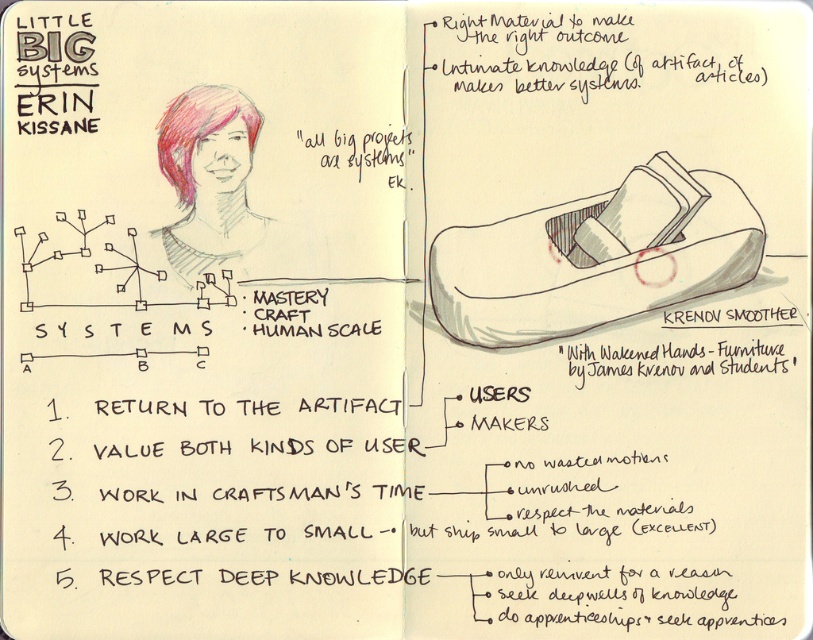
Question: Can you confirm if matte gray wood shoe at upper right is positioned to the right of matte black artifact at upper right?

Choices:
 (A) no
 (B) yes

Answer: (B)

Question: Which object is closer to the camera taking this photo?

Choices:
 (A) matte black artifact at upper right
 (B) matte gray wood shoe at upper right

Answer: (B)

Question: Does matte gray wood shoe at upper right lie in front of matte black artifact at upper right?

Choices:
 (A) yes
 (B) no

Answer: (A)

Question: Can you confirm if matte gray wood shoe at upper right is wider than matte black artifact at upper right?

Choices:
 (A) yes
 (B) no

Answer: (B)